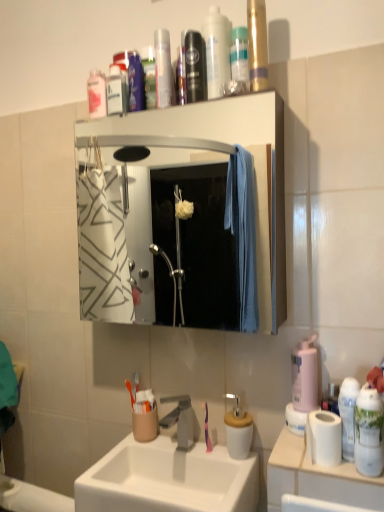
Question: Is white ceramic sink at center outside transparent plastic bottle at upper center, the 1th mouthwash from the right?

Choices:
 (A) no
 (B) yes

Answer: (B)

Question: From a real-world perspective, is white ceramic sink at center on transparent plastic bottle at upper center, the third mouthwash viewed from the left?

Choices:
 (A) no
 (B) yes

Answer: (A)

Question: Is white ceramic sink at center thinner than transparent plastic bottle at upper center, the second mouthwash in the front-to-back sequence?

Choices:
 (A) no
 (B) yes

Answer: (A)

Question: Considering the relative sizes of white ceramic sink at center and transparent plastic bottle at upper center, the 1th mouthwash from the right, in the image provided, is white ceramic sink at center smaller than transparent plastic bottle at upper center, the 1th mouthwash from the right,?

Choices:
 (A) yes
 (B) no

Answer: (B)

Question: From a real-world perspective, is white ceramic sink at center below transparent plastic bottle at upper center, the second mouthwash positioned from the back?

Choices:
 (A) no
 (B) yes

Answer: (B)

Question: Based on their positions, is translucent plastic bottle at upper center, arranged as the first cleaning product when viewed from the back, located to the left or right of translucent plastic mouthwash at upper left, the 1th mouthwash from the back?

Choices:
 (A) right
 (B) left

Answer: (A)

Question: Considering the positions of translucent plastic bottle at upper center, the third cleaning product positioned from the bottom, and translucent plastic mouthwash at upper left, the 1th mouthwash from the left, in the image, is translucent plastic bottle at upper center, the third cleaning product positioned from the bottom, wider or thinner than translucent plastic mouthwash at upper left, the 1th mouthwash from the left,?

Choices:
 (A) thin
 (B) wide

Answer: (B)

Question: Is translucent plastic bottle at upper center, positioned as the 1th cleaning product in left-to-right order, bigger or smaller than translucent plastic mouthwash at upper left, which is counted as the 3th mouthwash, starting from the right?

Choices:
 (A) big
 (B) small

Answer: (A)

Question: From the image's perspective, is translucent plastic bottle at upper center, arranged as the first cleaning product when viewed from the back, positioned above or below translucent plastic mouthwash at upper left, the 1th mouthwash from the left?

Choices:
 (A) above
 (B) below

Answer: (A)

Question: Relative to transparent plastic bottle at upper center, the 1th mouthwash from the right, is translucent plastic mouthwash at upper left, the 1th mouthwash from the back, in front or behind?

Choices:
 (A) front
 (B) behind

Answer: (B)

Question: Considering the positions of translucent plastic mouthwash at upper left, which is counted as the 3th mouthwash, starting from the right, and transparent plastic bottle at upper center, the third mouthwash viewed from the left, in the image, is translucent plastic mouthwash at upper left, which is counted as the 3th mouthwash, starting from the right, wider or thinner than transparent plastic bottle at upper center, the third mouthwash viewed from the left,?

Choices:
 (A) thin
 (B) wide

Answer: (B)

Question: From a real-world perspective, relative to transparent plastic bottle at upper center, the 1th mouthwash from the right, is translucent plastic mouthwash at upper left, the third mouthwash from the front, vertically above or below?

Choices:
 (A) above
 (B) below

Answer: (B)

Question: Is translucent plastic mouthwash at upper left, the third mouthwash from the front, inside or outside of transparent plastic bottle at upper center, the second mouthwash positioned from the back?

Choices:
 (A) outside
 (B) inside

Answer: (A)

Question: From their relative heights in the image, would you say white ceramic sink at center is taller or shorter than translucent plastic bottle at upper center, positioned as the 1th cleaning product in left-to-right order?

Choices:
 (A) tall
 (B) short

Answer: (B)

Question: Is point (177, 458) closer or farther from the camera than point (215, 53)?

Choices:
 (A) closer
 (B) farther

Answer: (B)